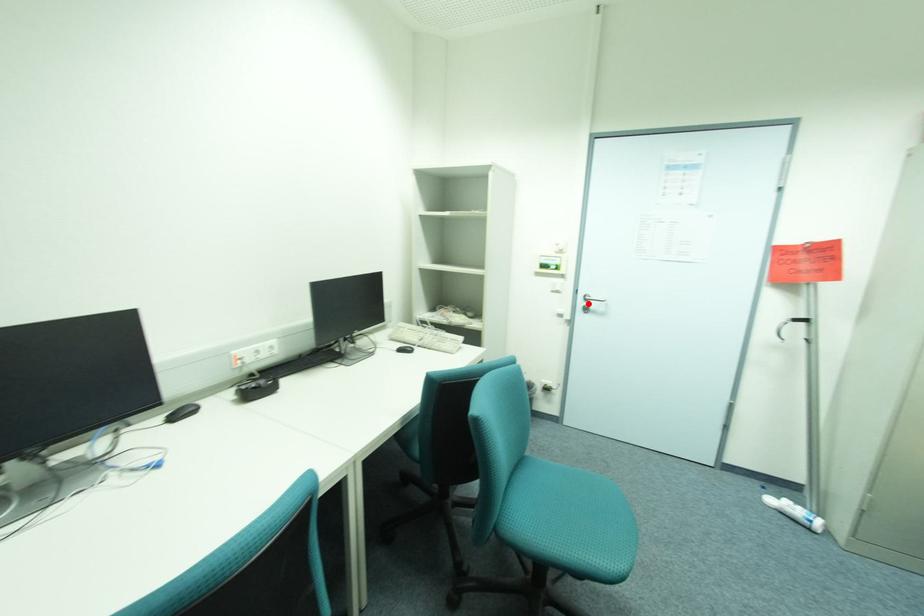
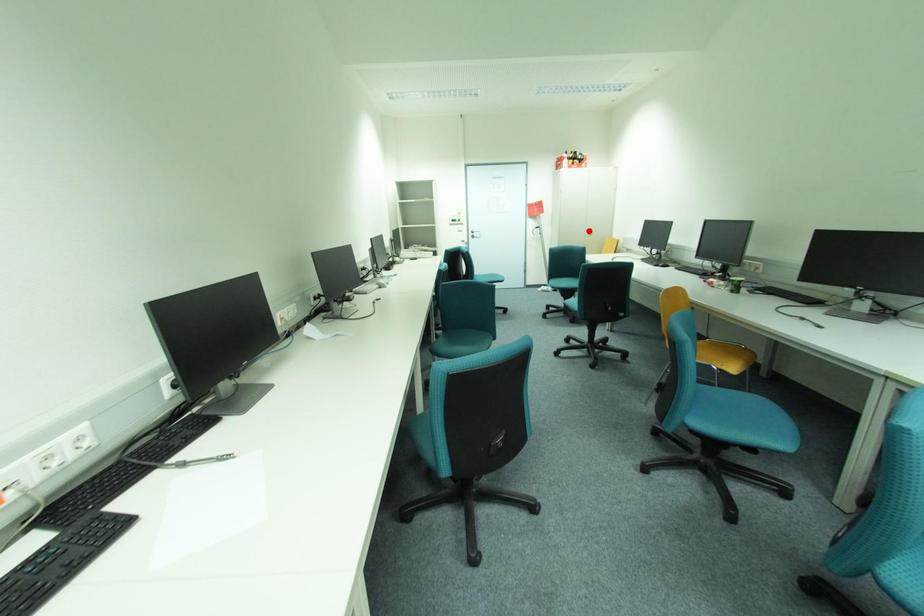
I am providing you with two images of the same scene from different viewpoints. A red point is marked on the first image and another point is marked on the second image. Is the red point in image1 aligned with the point shown in image2?

No